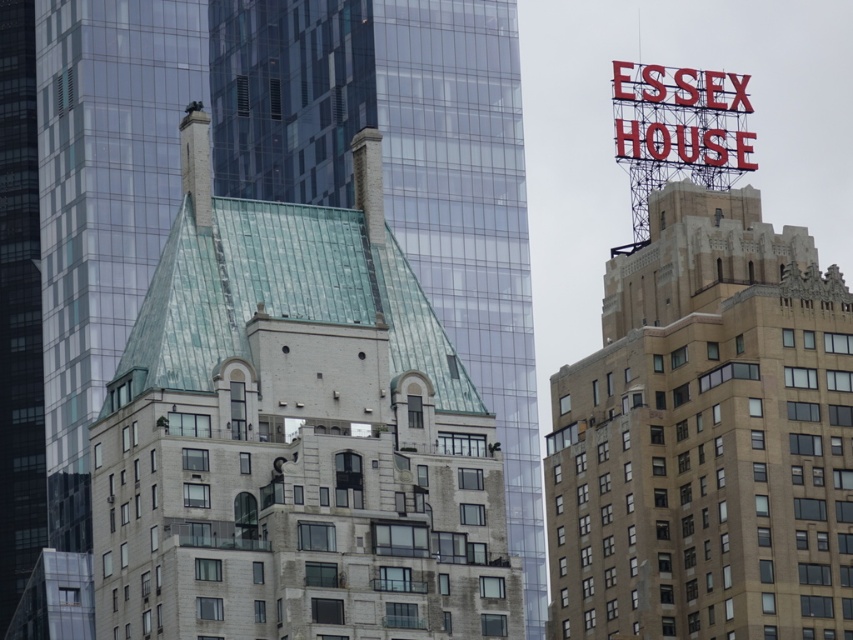
Between white brick building at center and beige stone building at upper right, which one is positioned lower?

beige stone building at upper right is lower down.

Is point (274, 552) behind point (643, 342)?

No, it is in front of (643, 342).

Image resolution: width=853 pixels, height=640 pixels. What are the coordinates of `white brick building at center` in the screenshot? It's located at (294, 436).